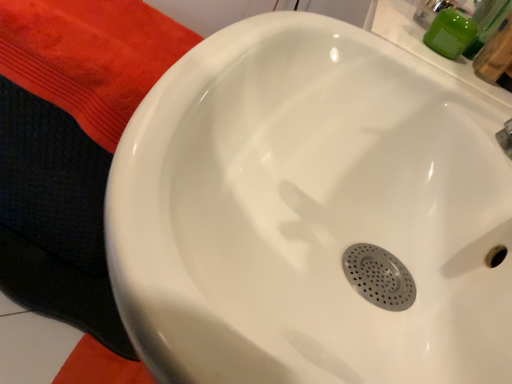
Question: Can we say green matte soap dispenser at upper right lies outside silver metallic faucet at upper right?

Choices:
 (A) no
 (B) yes

Answer: (B)

Question: Does green matte soap dispenser at upper right come behind silver metallic faucet at upper right?

Choices:
 (A) no
 (B) yes

Answer: (B)

Question: Considering the relative positions of green matte soap dispenser at upper right and silver metallic faucet at upper right in the image provided, is green matte soap dispenser at upper right to the left of silver metallic faucet at upper right from the viewer's perspective?

Choices:
 (A) yes
 (B) no

Answer: (A)

Question: Is green matte soap dispenser at upper right bigger than silver metallic faucet at upper right?

Choices:
 (A) no
 (B) yes

Answer: (A)

Question: Are green matte soap dispenser at upper right and silver metallic faucet at upper right far apart?

Choices:
 (A) no
 (B) yes

Answer: (A)

Question: From a real-world perspective, is green matte soap dispenser at upper right located beneath silver metallic faucet at upper right?

Choices:
 (A) no
 (B) yes

Answer: (B)

Question: Considering the relative positions of silver metallic faucet at upper right and green matte soap dispenser at upper right in the image provided, is silver metallic faucet at upper right to the left of green matte soap dispenser at upper right from the viewer's perspective?

Choices:
 (A) no
 (B) yes

Answer: (A)

Question: From the image's perspective, is silver metallic faucet at upper right located beneath green matte soap dispenser at upper right?

Choices:
 (A) yes
 (B) no

Answer: (A)

Question: Is silver metallic faucet at upper right looking in the opposite direction of green matte soap dispenser at upper right?

Choices:
 (A) yes
 (B) no

Answer: (B)

Question: Is silver metallic faucet at upper right closer to the viewer compared to green matte soap dispenser at upper right?

Choices:
 (A) no
 (B) yes

Answer: (B)

Question: Is silver metallic faucet at upper right shorter than green matte soap dispenser at upper right?

Choices:
 (A) no
 (B) yes

Answer: (A)

Question: From a real-world perspective, does silver metallic faucet at upper right stand above green matte soap dispenser at upper right?

Choices:
 (A) no
 (B) yes

Answer: (B)

Question: Is silver metallic faucet at upper right situated inside green matte soap dispenser at upper right or outside?

Choices:
 (A) inside
 (B) outside

Answer: (B)